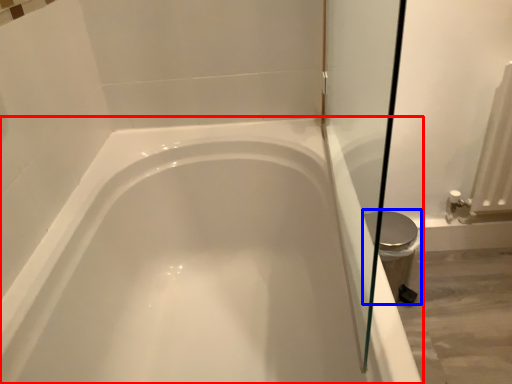
Question: Which of the following is the closest to the observer, bathtub (highlighted by a red box) or bidet (highlighted by a blue box)?

Choices:
 (A) bathtub
 (B) bidet

Answer: (A)